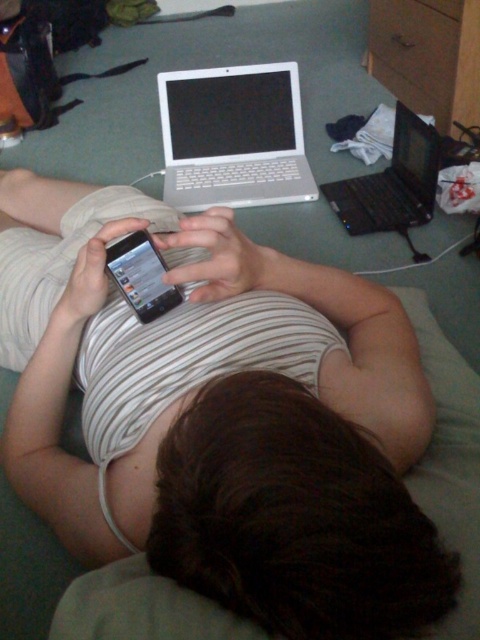
Question: Is matte black phone at upper center bigger than black plastic laptop at upper right?

Choices:
 (A) yes
 (B) no

Answer: (A)

Question: Can you confirm if wooden dresser at upper center is positioned above satin black phone at center?

Choices:
 (A) no
 (B) yes

Answer: (B)

Question: Considering the real-world distances, which object is closest to the silver metallic laptop at upper center?

Choices:
 (A) wooden dresser at upper center
 (B) black plastic laptop at upper right
 (C) satin black phone at center
 (D) matte black phone at upper center

Answer: (B)

Question: Can you confirm if silver metallic laptop at upper center is positioned below wooden dresser at upper center?

Choices:
 (A) no
 (B) yes

Answer: (B)

Question: Which of the following is the closest to the observer?

Choices:
 (A) (162, 308)
 (B) (412, 131)
 (C) (444, 49)
 (D) (173, 161)

Answer: (A)

Question: Which point is closer to the camera?

Choices:
 (A) (141, 272)
 (B) (343, 589)

Answer: (B)